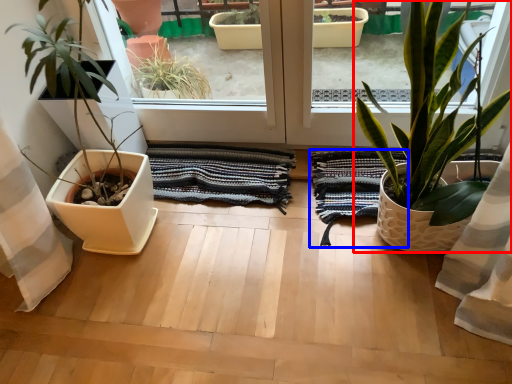
Question: Which object is further to the camera taking this photo, houseplant (highlighted by a red box) or bath towel (highlighted by a blue box)?

Choices:
 (A) houseplant
 (B) bath towel

Answer: (B)